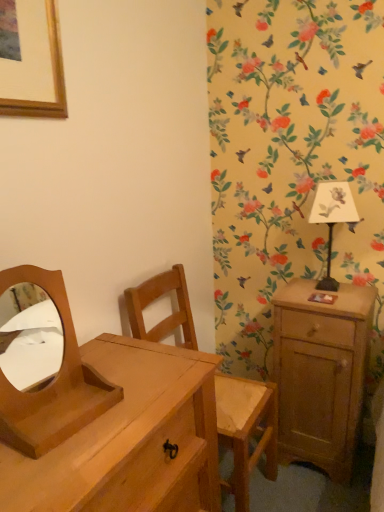
At what (x,y) coordinates should I click in order to perform the action: click on free space to the left of white paper lampshade at upper right. Please return your answer as a coordinate pair (x, y). Image resolution: width=384 pixels, height=512 pixels. Looking at the image, I should click on (290, 293).